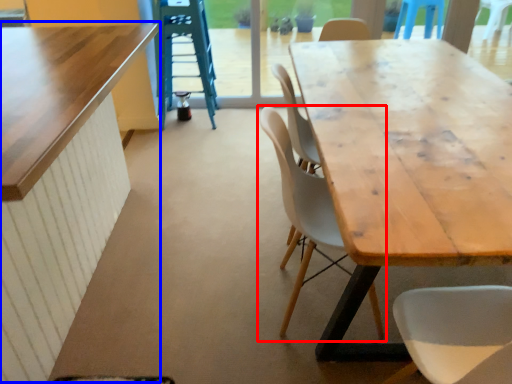
Question: Which object is closer to the camera taking this photo, chair (highlighted by a red box) or table (highlighted by a blue box)?

Choices:
 (A) chair
 (B) table

Answer: (B)